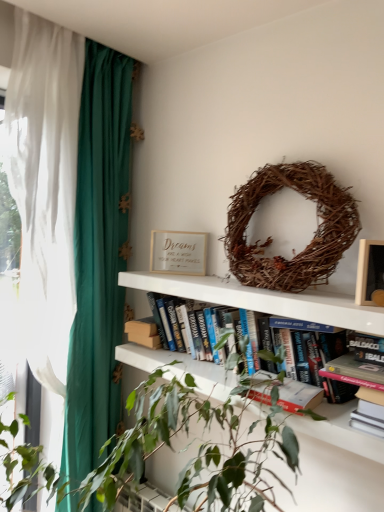
Question: Can you confirm if matte gold frame at upper center is bigger than wooden picture frame at upper right?

Choices:
 (A) no
 (B) yes

Answer: (B)

Question: From the image's perspective, is matte gold frame at upper center located beneath wooden picture frame at upper right?

Choices:
 (A) yes
 (B) no

Answer: (B)

Question: Is matte gold frame at upper center outside of wooden picture frame at upper right?

Choices:
 (A) yes
 (B) no

Answer: (A)

Question: From the image's perspective, would you say matte gold frame at upper center is positioned over wooden picture frame at upper right?

Choices:
 (A) yes
 (B) no

Answer: (A)

Question: Is matte gold frame at upper center oriented towards wooden picture frame at upper right?

Choices:
 (A) no
 (B) yes

Answer: (A)

Question: From a real-world perspective, is matte gold frame at upper center above or below green leafy plant at center?

Choices:
 (A) above
 (B) below

Answer: (A)

Question: Is matte gold frame at upper center inside or outside of green leafy plant at center?

Choices:
 (A) inside
 (B) outside

Answer: (B)

Question: Is matte gold frame at upper center taller or shorter than green leafy plant at center?

Choices:
 (A) tall
 (B) short

Answer: (B)

Question: Is matte gold frame at upper center in front of or behind green leafy plant at center in the image?

Choices:
 (A) behind
 (B) front

Answer: (A)

Question: In the image, is hardcover books at center on the left side or the right side of brown woven wreath at upper center?

Choices:
 (A) left
 (B) right

Answer: (A)

Question: Relative to brown woven wreath at upper center, is hardcover books at center in front or behind?

Choices:
 (A) behind
 (B) front

Answer: (B)

Question: Is hardcover books at center taller or shorter than brown woven wreath at upper center?

Choices:
 (A) short
 (B) tall

Answer: (A)

Question: Looking at their shapes, would you say hardcover books at center is wider or thinner than brown woven wreath at upper center?

Choices:
 (A) wide
 (B) thin

Answer: (A)

Question: Is hardcover books at center spatially inside wooden picture frame at upper right, or outside of it?

Choices:
 (A) outside
 (B) inside

Answer: (A)

Question: From the image's perspective, is hardcover books at center located above or below wooden picture frame at upper right?

Choices:
 (A) above
 (B) below

Answer: (B)